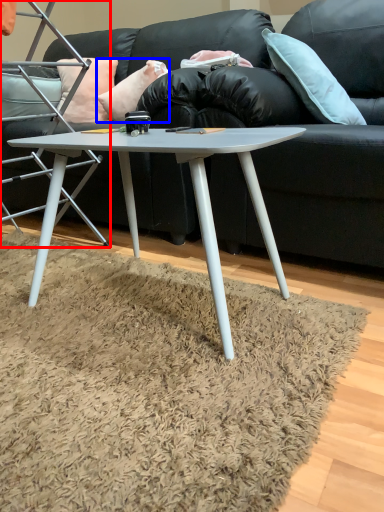
Question: Which point is further to the camera, chair (highlighted by a red box) or pillow (highlighted by a blue box)?

Choices:
 (A) chair
 (B) pillow

Answer: (B)